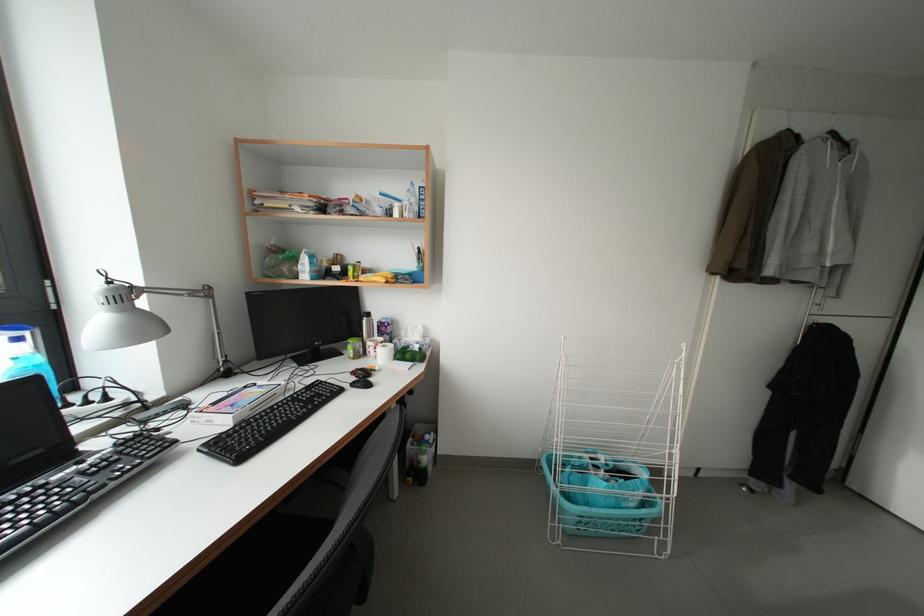
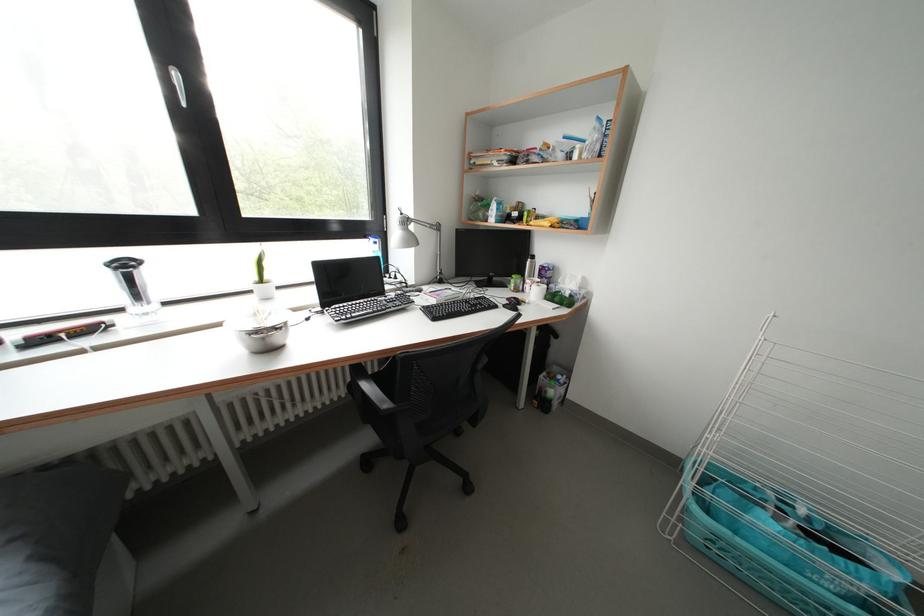
In the second image, find the point that corresponds to pixel 594 509 in the first image.

(743, 537)